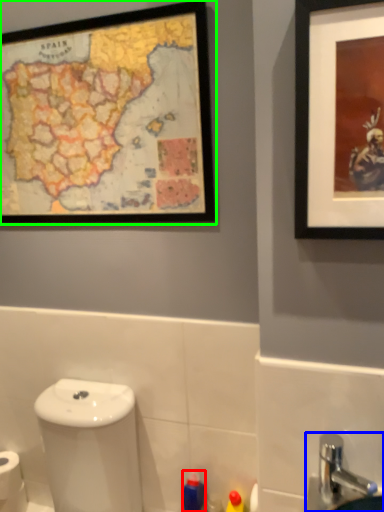
Question: Considering the real-world distances, which object is farthest from toiletry (highlighted by a red box)? sink (highlighted by a blue box) or picture frame (highlighted by a green box)?

Choices:
 (A) sink
 (B) picture frame

Answer: (B)